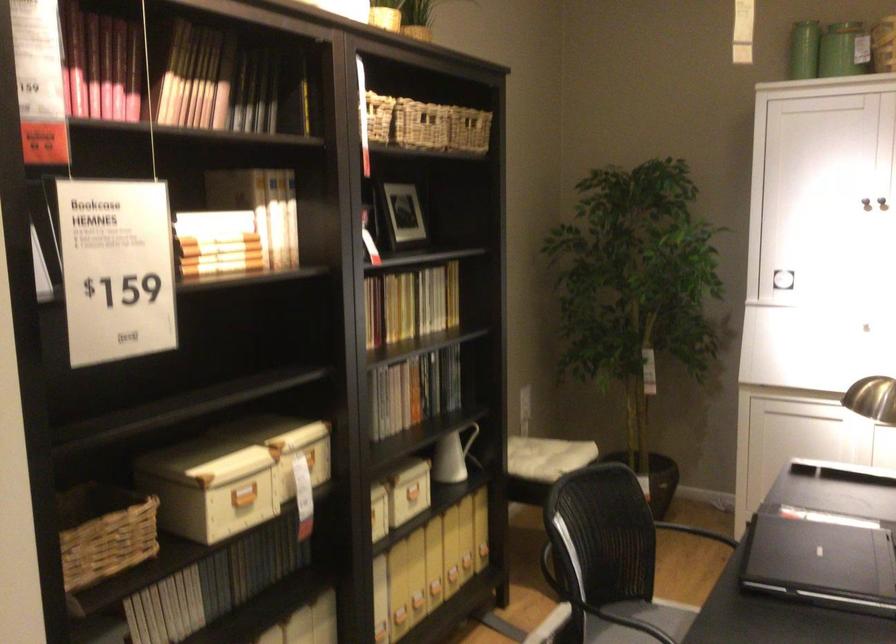
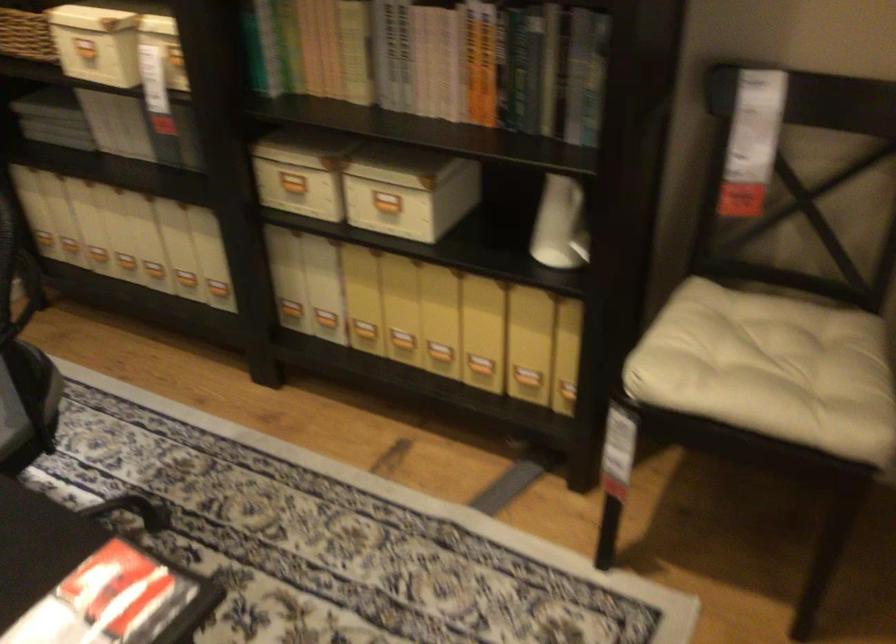
Find the pixel in the second image that matches (x=177, y=522) in the first image.

(83, 49)